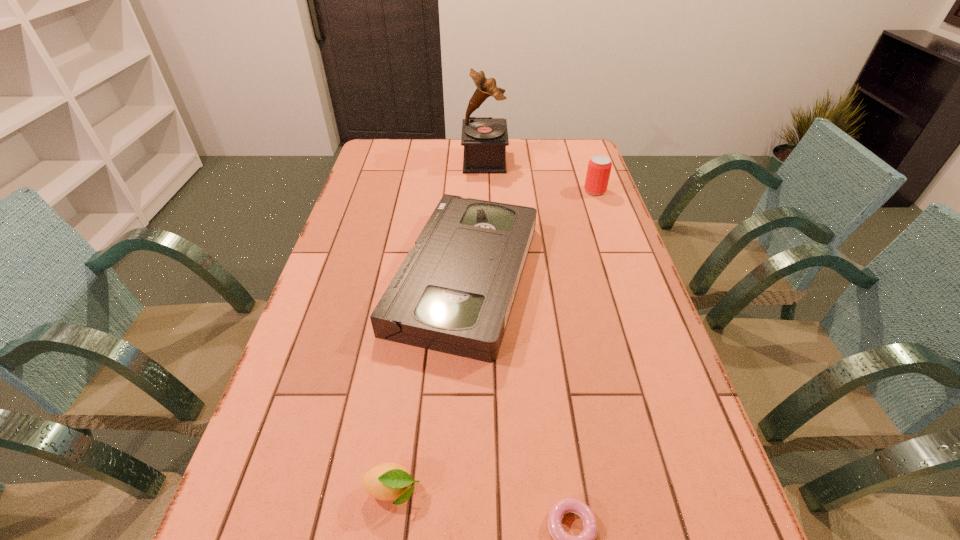
I want to click on phonograph_record, so click(x=484, y=139).

At what (x,y) coordinates should I click in order to perform the action: click on the farthest object. Please return your answer as a coordinate pair (x, y). Image resolution: width=960 pixels, height=540 pixels. Looking at the image, I should click on (484, 139).

Image resolution: width=960 pixels, height=540 pixels. In order to click on the rightmost object in this screenshot , I will do `click(599, 167)`.

Where is `the second tallest object`? the second tallest object is located at coordinates (599, 167).

At what (x,y) coordinates should I click in order to perform the action: click on videotape. Please return your answer as a coordinate pair (x, y). Looking at the image, I should click on 453,293.

Locate an element on the screen. The width and height of the screenshot is (960, 540). lemon is located at coordinates (388, 481).

Where is `free space located at the horn opening of the tallest object`? This screenshot has width=960, height=540. free space located at the horn opening of the tallest object is located at coordinates (421, 160).

Locate an element on the screen. This screenshot has width=960, height=540. free location located 0.340m at the horn opening of the tallest object is located at coordinates (374, 160).

Identify the location of free region located at the horn opening of the tallest object. The height and width of the screenshot is (540, 960). (380, 160).

At what (x,y) coordinates should I click in order to perform the action: click on vacant area located 0.320m on the front of the beer can. Please return your answer as a coordinate pair (x, y). Looking at the image, I should click on (618, 256).